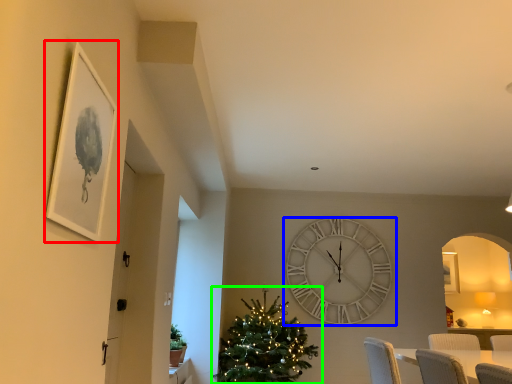
Question: Estimate the real-world distances between objects in this image. Which object is farther from picture frame (highlighted by a red box), wall clock (highlighted by a blue box) or christmas tree (highlighted by a green box)?

Choices:
 (A) wall clock
 (B) christmas tree

Answer: (A)